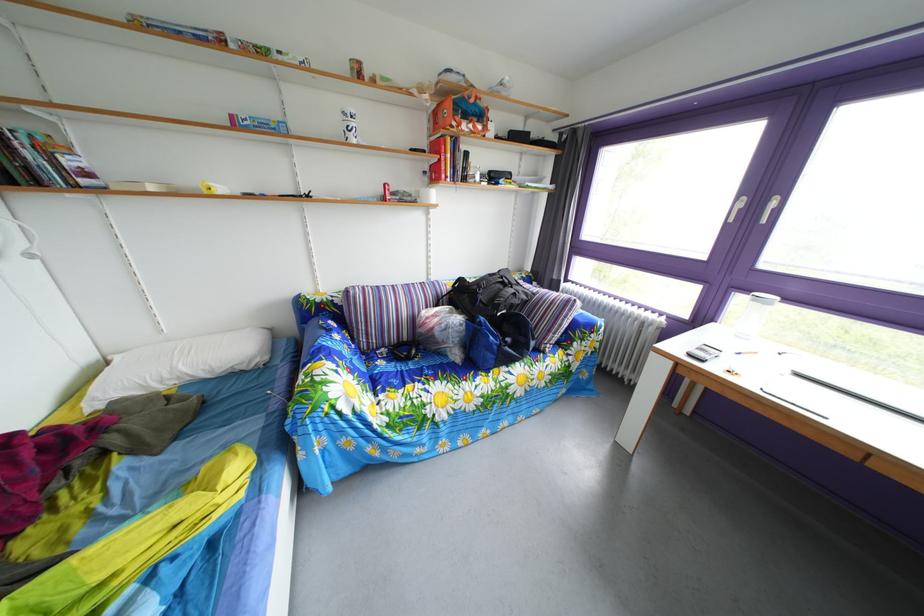
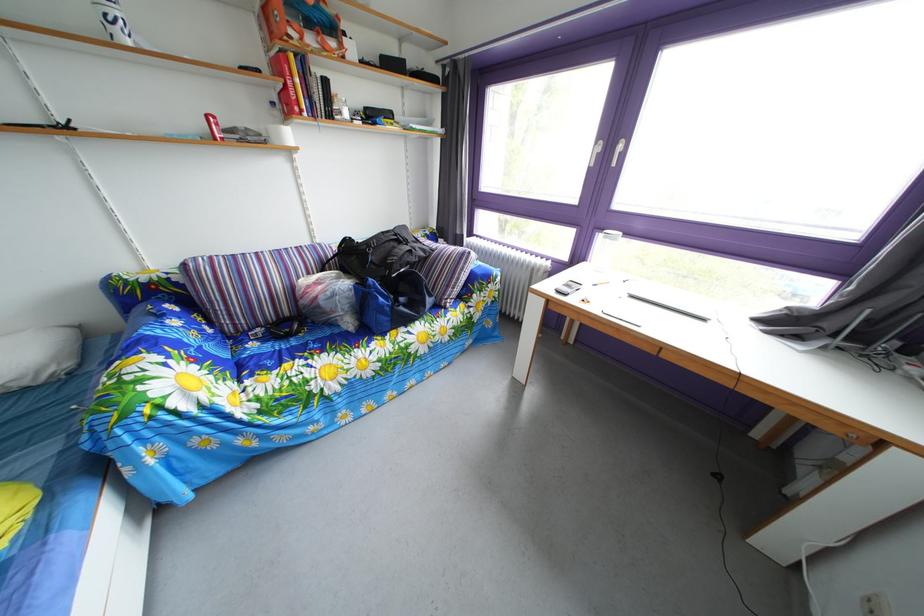
Question: I am providing you with two images of the same scene from different viewpoints. Which of the following objects are not visible in image2?

Choices:
 (A) striped cushion
 (B) black backpack
 (C) sofa sitting surface
 (D) none of these

Answer: (D)